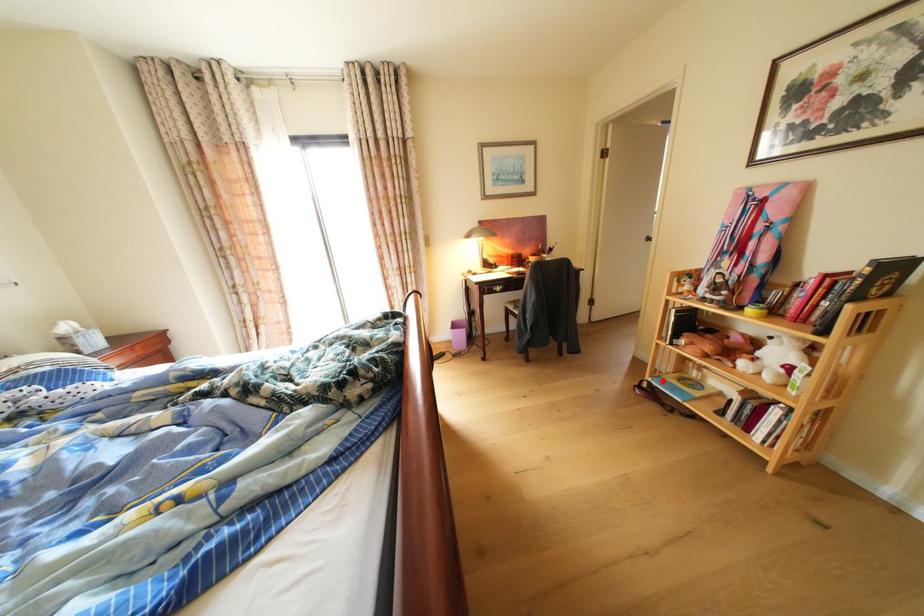
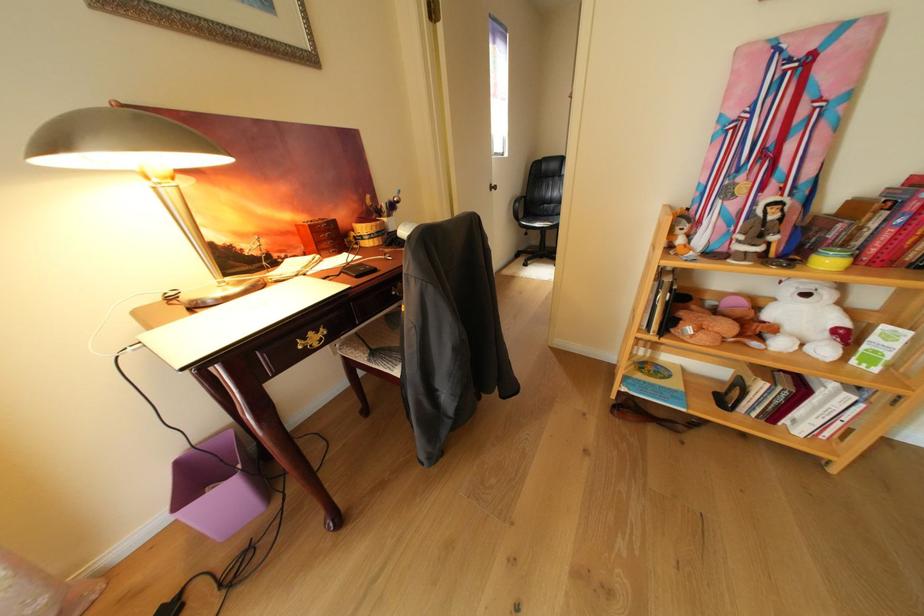
Question: I am providing you with two images of the same scene from different viewpoints. A red point is shown in image1. For the corresponding object point in image2, is it positioned nearer or farther from the camera?

Choices:
 (A) Nearer
 (B) Farther

Answer: (A)